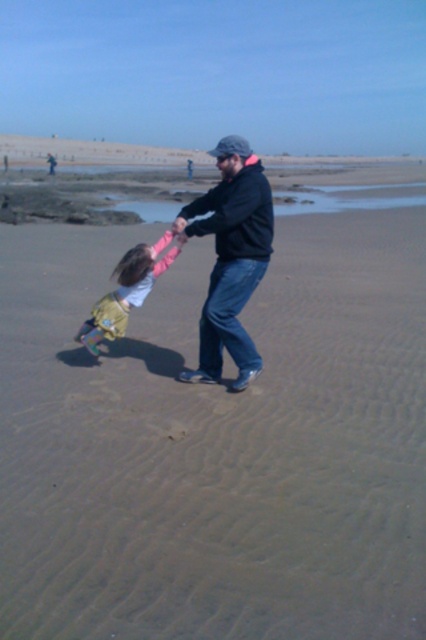
You are standing on the beach and see the black matte jacket at center and the light pink fabric dress at lower left. Which clothing item is taller?

The black matte jacket at center is taller than the light pink fabric dress at lower left.

You are taking a photo of the beach scene. You notice two points marked as point 1 at coordinates point (218, 212) and point 2 at coordinates point (164, 269). Which point should you focus on to ensure the foreground is sharp?

Point 1 at coordinates point (218, 212) should be focused on because it is closer to the camera, ensuring the foreground elements are in sharp focus.

You are standing on the beach and want to take a photo of both the black matte jacket at center and the light pink fabric dress at lower left. Which one should you focus on first to ensure both are in clear view?

You should focus on the black matte jacket at center first because it is closer to you than the light pink fabric dress at lower left, so adjusting focus from near to far will help both be in clear view.